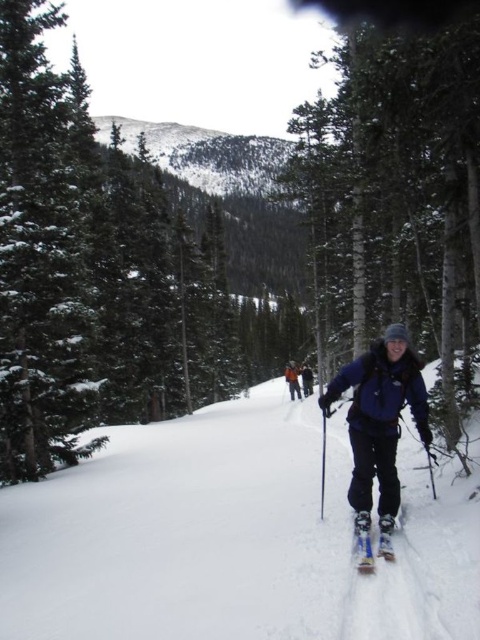
Is matte blue jacket at center smaller than white matte ski at lower center?

No, matte blue jacket at center is not smaller than white matte ski at lower center.

Can you confirm if matte blue jacket at center is positioned to the left of white matte ski at lower center?

No, matte blue jacket at center is not to the left of white matte ski at lower center.

Which is in front, point (393, 464) or point (368, 572)?

Point (368, 572) is in front.

This screenshot has height=640, width=480. Find the location of `matte blue jacket at center`. matte blue jacket at center is located at coordinates (380, 419).

Who is more forward, (364, 184) or (305, 362)?

Positioned in front is point (364, 184).

This screenshot has height=640, width=480. Identify the location of smooth white snow at center. (416, 136).

Is white snow ski slope at center shorter than smooth white snow at center?

Indeed, white snow ski slope at center has a lesser height compared to smooth white snow at center.

Who is more forward, (55, 483) or (336, 113)?

Point (55, 483)

Identify the location of white snow ski slope at center. (232, 538).